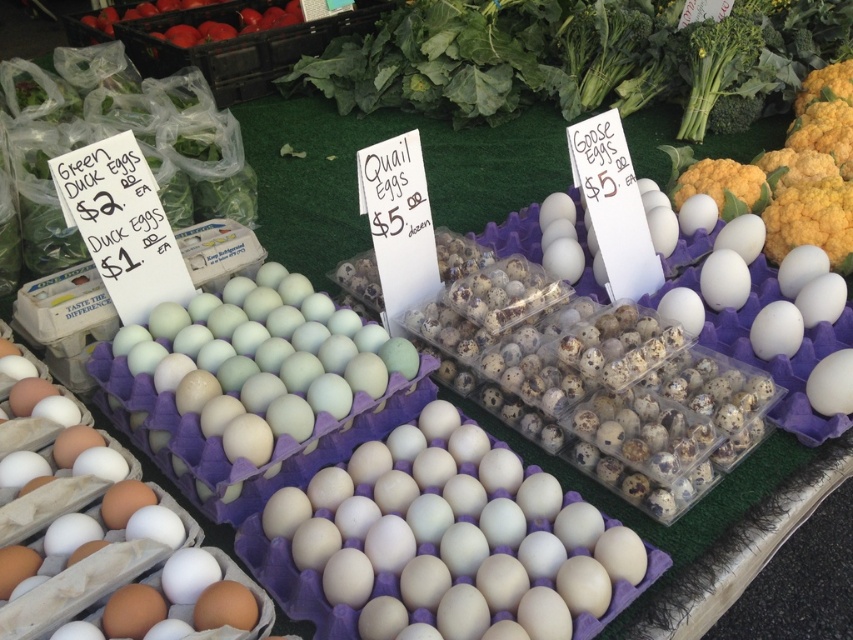
You are a customer at the market stall and want to buy a dozen eggs. You notice two white matte eggs at center and a single white matte egg at center. Which one should you choose to get a full dozen?

The white matte eggs at center are a dozen, so you should choose them to get a full dozen.